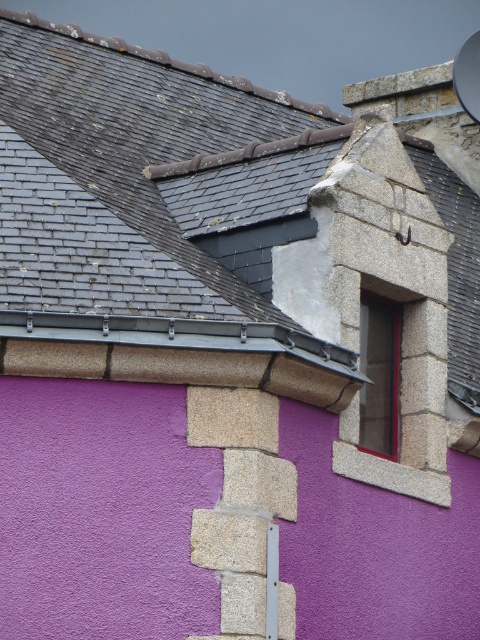
You are standing in front of the building and notice the gray slate roof at upper left and the smooth stone window at upper right. Which object is positioned higher relative to the other?

The gray slate roof at upper left is located above the smooth stone window at upper right, so it is positioned higher.

You are an architect assessing the building facade. You need to determine which object, the gray slate roof at upper left or the smooth stone window at upper right, has a greater width. Based on the scene, which one is wider?

The gray slate roof at upper left is wider than the smooth stone window at upper right according to the description.